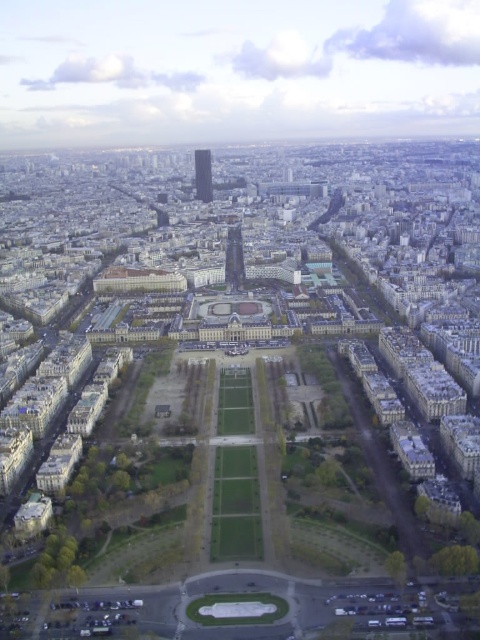
You are a drone operator flying a drone over the city. Your drone is currently at point (x=228, y=273). You want to fly it to point (x=204, y=150). Will the drone have to pass over any buildings between these two points?

Point (x=228, y=273) is in front of point (x=204, y=150), so the drone will not have to pass over any buildings between these two points.

You are planning to place a new statue in the park. The statue requires a base that is wider than the shiny metallic eiffel tower at center but narrower than the smooth glass skyscraper at center. Is there enough space between them to accommodate the statue base?

The shiny metallic eiffel tower at center is narrower than the smooth glass skyscraper at center. Therefore, there is a width range between them that can accommodate the statue base as required.